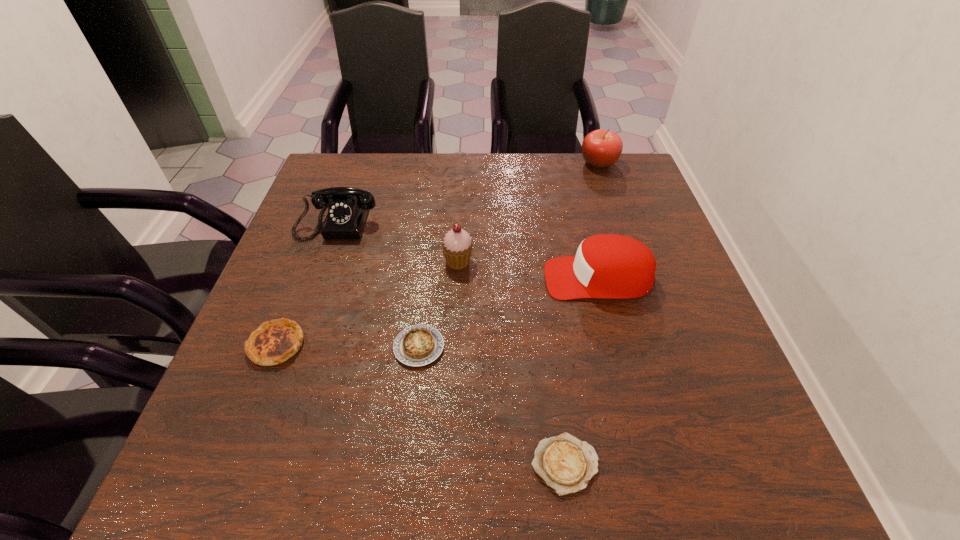
Image resolution: width=960 pixels, height=540 pixels. In order to click on vacant space located 0.340m on the left of the apple in this screenshot , I will do `click(467, 163)`.

Locate an element on the screen. This screenshot has width=960, height=540. vacant space situated on the left of the cupcake is located at coordinates (319, 261).

Locate an element on the screen. This screenshot has width=960, height=540. free space located on the dial of the sixth nearest object is located at coordinates (324, 265).

Locate an element on the screen. vacant space located 0.110m on the front-facing side of the baseball cap is located at coordinates (495, 278).

The height and width of the screenshot is (540, 960). What are the coordinates of `free space located 0.180m on the front-facing side of the baseball cap` in the screenshot? It's located at (465, 278).

Where is `blank area located on the front-facing side of the baseball cap`? The height and width of the screenshot is (540, 960). blank area located on the front-facing side of the baseball cap is located at coordinates (478, 278).

Identify the location of free space located on the right of the leftmost quiche. Image resolution: width=960 pixels, height=540 pixels. (507, 345).

Locate an element on the screen. The width and height of the screenshot is (960, 540). vacant space located 0.300m on the left of the second shortest object is located at coordinates (241, 347).

This screenshot has height=540, width=960. I want to click on vacant area situated 0.230m on the back of the shortest quiche, so click(x=546, y=325).

Locate an element on the screen. Image resolution: width=960 pixels, height=540 pixels. apple present at the far edge is located at coordinates (600, 148).